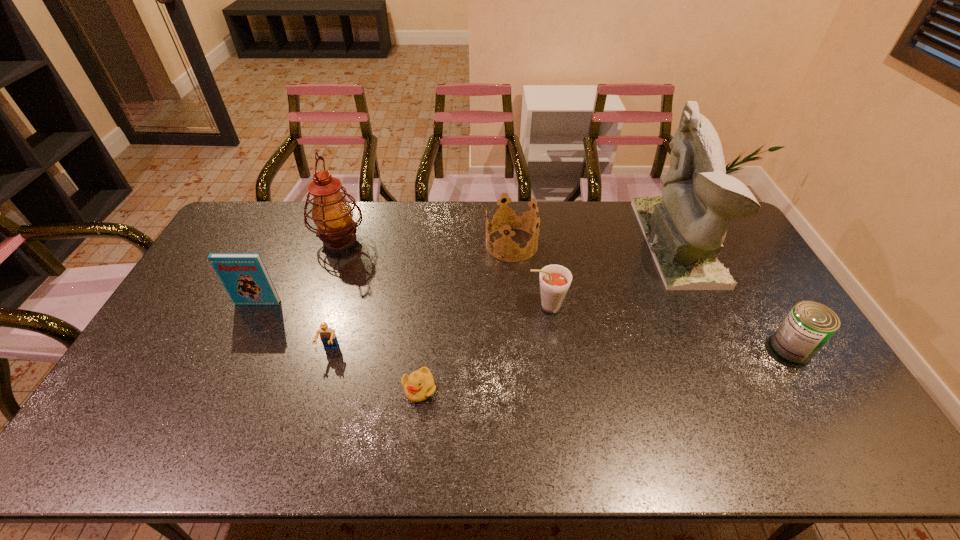
You are a GUI agent. You are given a task and a screenshot of the screen. Output one action in this format:
    pyautogui.click(x=<x>, y=<y>)
    Task: Click on the vacant region at the left edge of the desktop
    This screenshot has width=960, height=540.
    Given the screenshot: What is the action you would take?
    pyautogui.click(x=123, y=426)

In the image, there is a desktop. What are the coordinates of `free space at the right edge` in the screenshot? It's located at (842, 421).

The image size is (960, 540). In order to click on blank space at the far left corner of the desktop in this screenshot , I will do coord(261,215).

Find the location of a particular element. The image size is (960, 540). free spot between the root beer and the rightmost object is located at coordinates [x=668, y=327].

Where is `free space between the can and the crown`? free space between the can and the crown is located at coordinates (651, 296).

At what (x,y) coordinates should I click in order to perform the action: click on empty space that is in between the sculpture and the second shortest object. Please return your answer as a coordinate pair (x, y). Image resolution: width=960 pixels, height=540 pixels. Looking at the image, I should click on (504, 296).

Where is `free area in between the leftmost object and the tallest object`? free area in between the leftmost object and the tallest object is located at coordinates (x=468, y=273).

Where is `vacant space that is in between the fifth object from right to left and the seventh object from left to right`? The height and width of the screenshot is (540, 960). vacant space that is in between the fifth object from right to left and the seventh object from left to right is located at coordinates (548, 315).

Identify the location of free space between the rightmost object and the root beer. Image resolution: width=960 pixels, height=540 pixels. (668, 327).

Find the location of a particular element. Image resolution: width=960 pixels, height=540 pixels. free space between the duckling and the Lego is located at coordinates (374, 369).